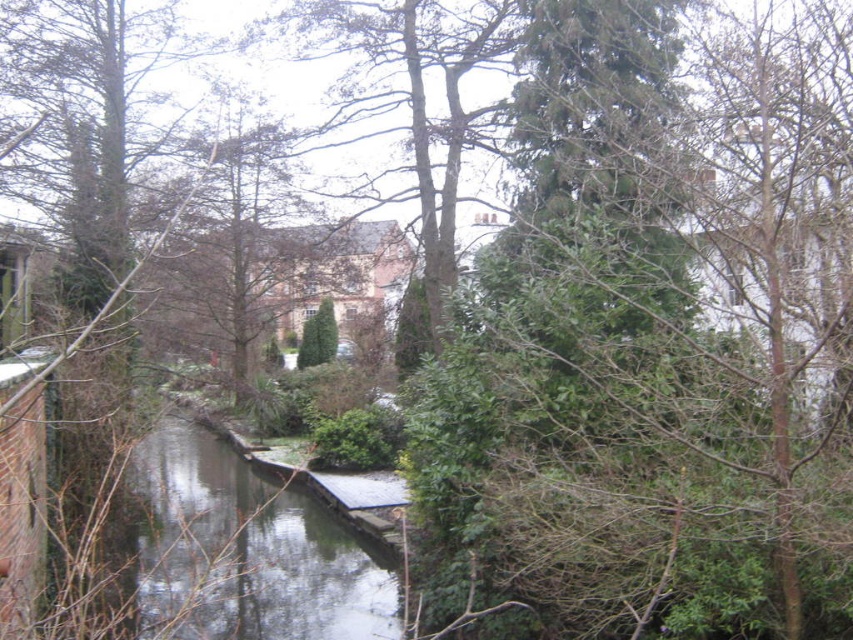
Question: Which point appears closest to the camera in this image?

Choices:
 (A) (358, 42)
 (B) (224, 202)
 (C) (326, 353)
 (D) (143, 460)

Answer: (A)

Question: Estimate the real-world distances between objects in this image. Which object is closer to the smooth bark tree at center?

Choices:
 (A) green leafy tree at center
 (B) brown leafy tree at center
 (C) clear water at center

Answer: (B)

Question: Does clear water at center have a lesser width compared to smooth bark tree at center?

Choices:
 (A) no
 (B) yes

Answer: (A)

Question: Among these points, which one is nearest to the camera?

Choices:
 (A) (287, 12)
 (B) (283, 522)

Answer: (B)

Question: Does clear water at center come behind brown leafy tree at center?

Choices:
 (A) no
 (B) yes

Answer: (A)

Question: Is clear water at center to the right of green leafy tree at center from the viewer's perspective?

Choices:
 (A) no
 (B) yes

Answer: (B)